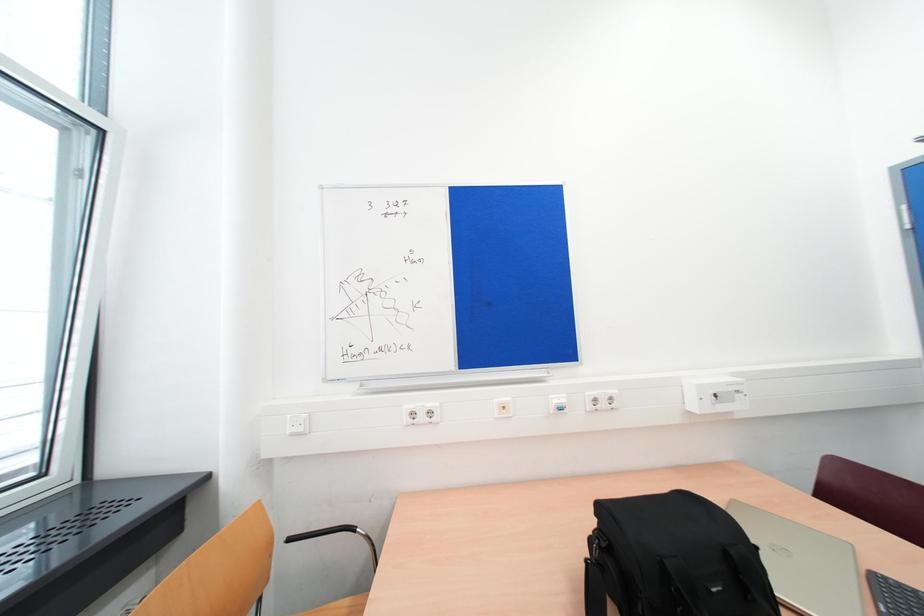
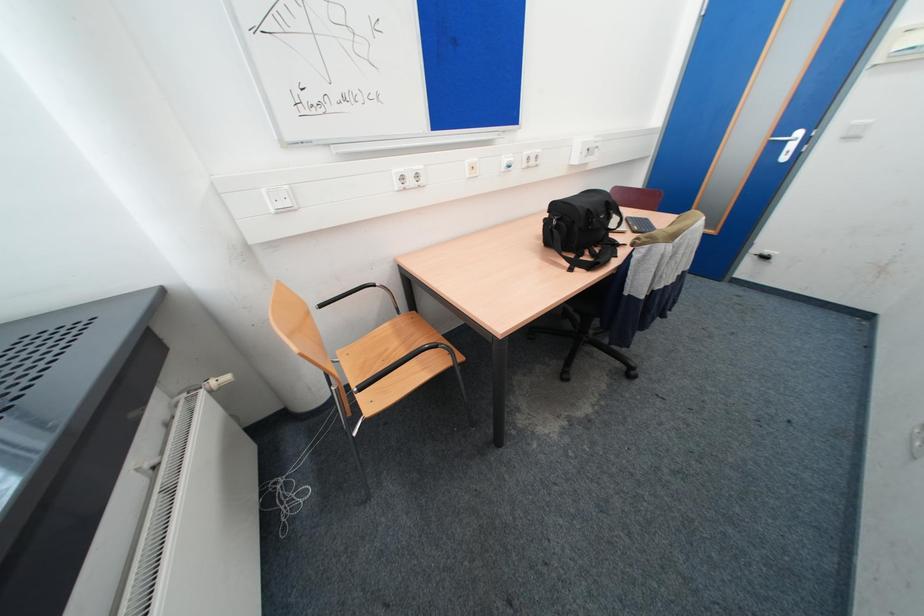
First-person continuous shooting, in which direction is the camera rotating?

The rotation direction of the camera is right-down.